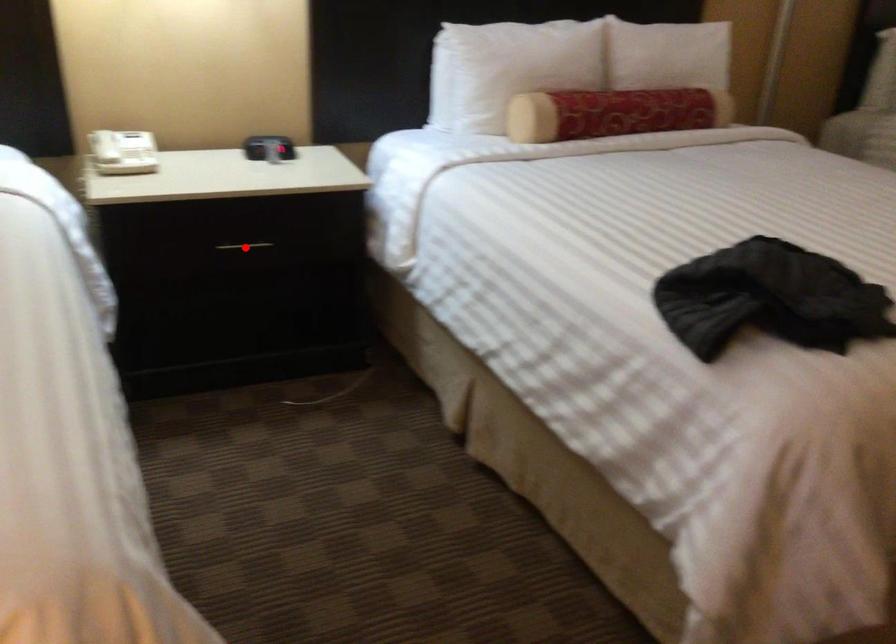
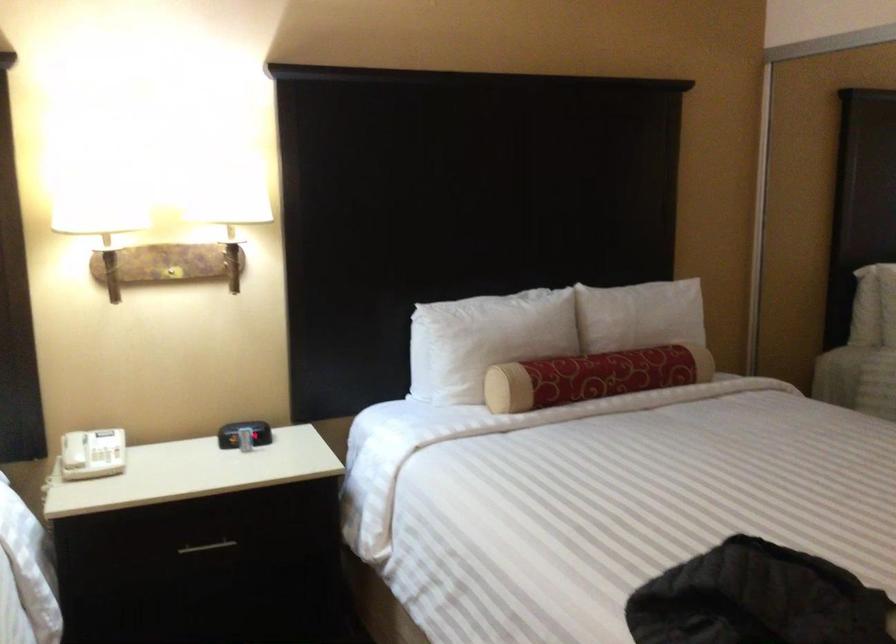
Question: I am providing you with two images of the same scene from different viewpoints. A red point is marked on the first image. Can you still see the location of the red point in image 2?

Choices:
 (A) Yes
 (B) No

Answer: (A)